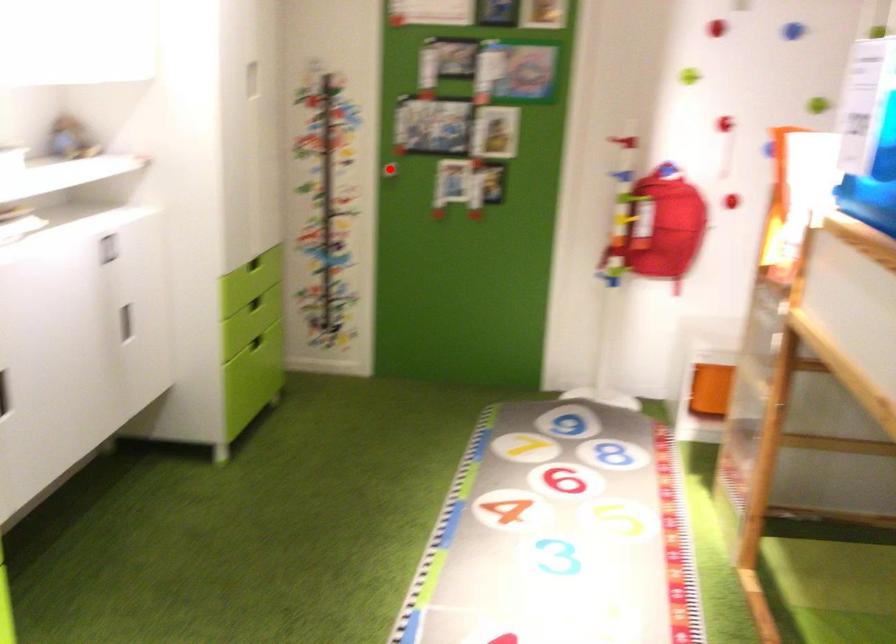
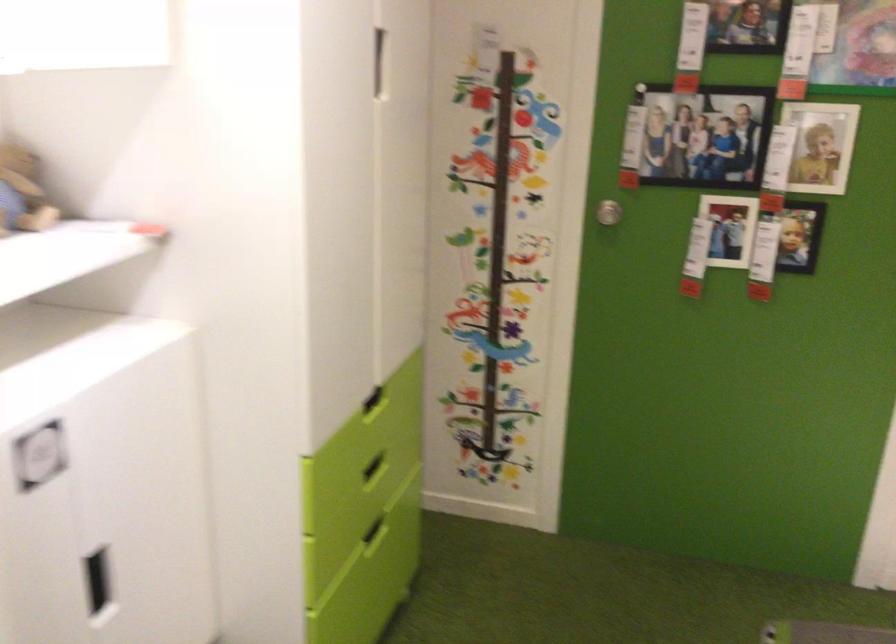
The point at the highlighted location is marked in the first image. Where is the corresponding point in the second image?

(607, 212)